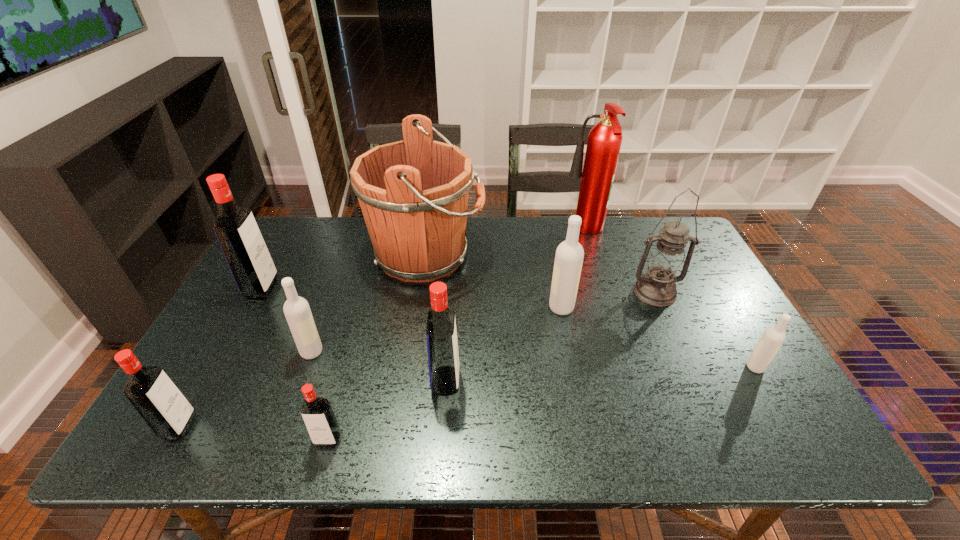
Locate an element on the screen. vacant space that is in between the third vodka from left to right and the oil lamp is located at coordinates (483, 322).

Find the location of a particular element. free space between the third red vodka from left to right and the gray oil lamp is located at coordinates (492, 366).

You are a GUI agent. You are given a task and a screenshot of the screen. Output one action in this format:
    pyautogui.click(x=<x>, y=<y>)
    Task: Click on the free space between the farthest white vodka and the tallest vodka
    
    Given the screenshot: What is the action you would take?
    pyautogui.click(x=412, y=298)

Identify the location of free space between the third biggest red vodka and the third red vodka from left to right. point(253,433).

This screenshot has width=960, height=540. Identify the location of unoccupied position between the farthest white vodka and the second object from right to left. click(608, 300).

Locate an element on the screen. free space between the third biggest red vodka and the biggest red vodka is located at coordinates (221, 357).

This screenshot has width=960, height=540. In order to click on vacant region between the bucket and the rightmost object in this screenshot , I will do `click(590, 311)`.

Find the location of a particular element. The width and height of the screenshot is (960, 540). unoccupied area between the smallest red vodka and the smallest white vodka is located at coordinates (541, 403).

Where is `unoccupied position between the smallest white vodka and the smallest red vodka`? The image size is (960, 540). unoccupied position between the smallest white vodka and the smallest red vodka is located at coordinates (541, 403).

Identify which object is located as the fourth nearest to the rightmost vodka. Please provide its 2D coordinates. Your answer should be formatted as a tuple, i.e. [(x, y)], where the tuple contains the x and y coordinates of a point satisfying the conditions above.

[(413, 194)]